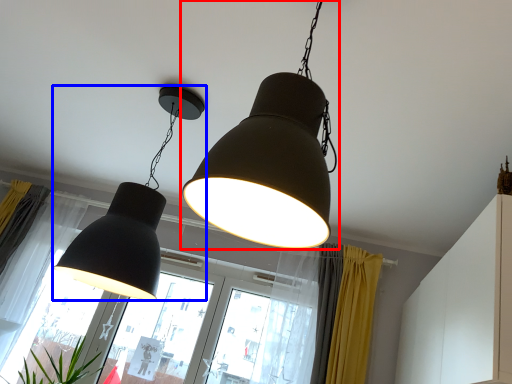
Question: Which of the following is the farthest to the observer, lamp (highlighted by a red box) or lamp (highlighted by a blue box)?

Choices:
 (A) lamp
 (B) lamp

Answer: (B)